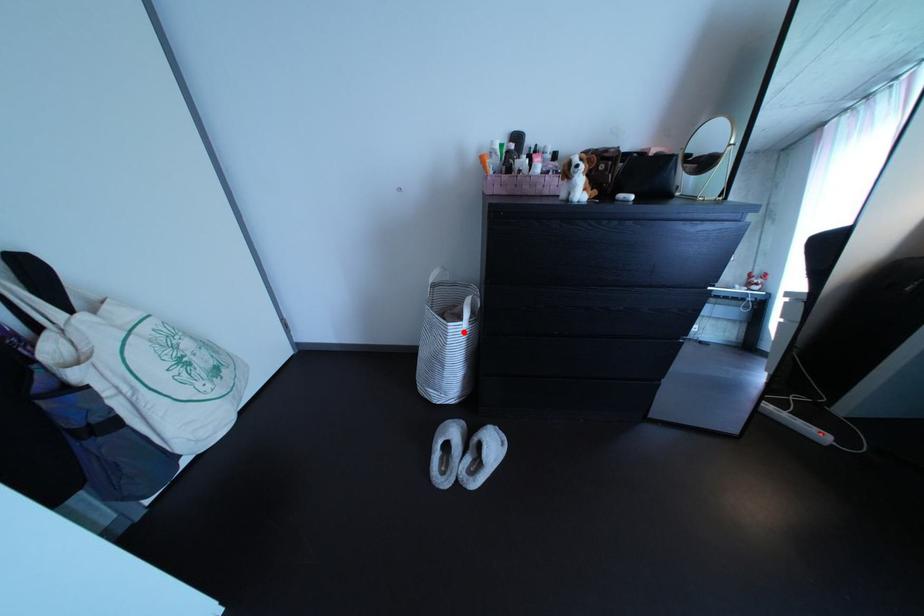
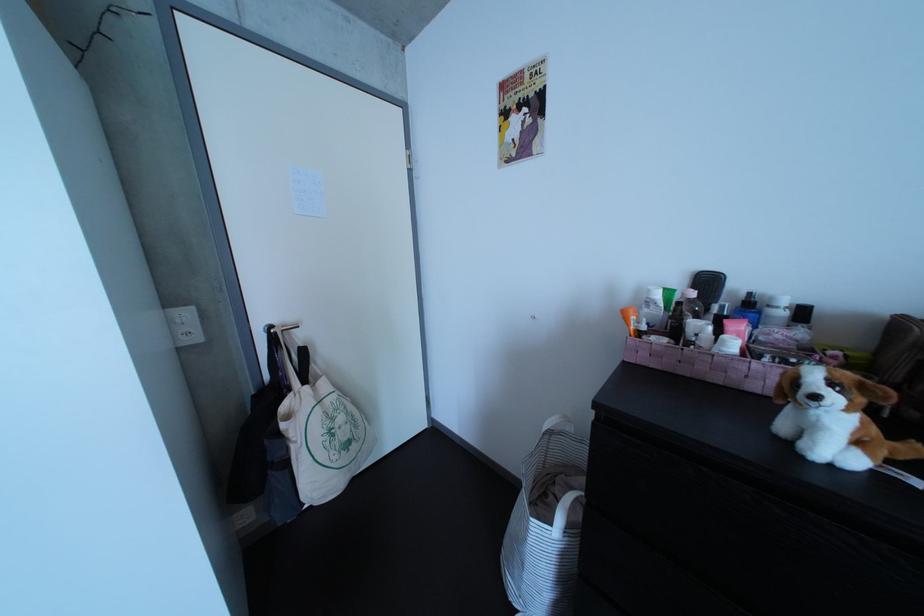
Question: I am providing you with two images of the same scene from different viewpoints. Image1 has a red point marked. In image2, the corresponding 3D location appears at what relative position? Reply with the corresponding letter.

Choices:
 (A) Closer
 (B) Farther

Answer: (A)